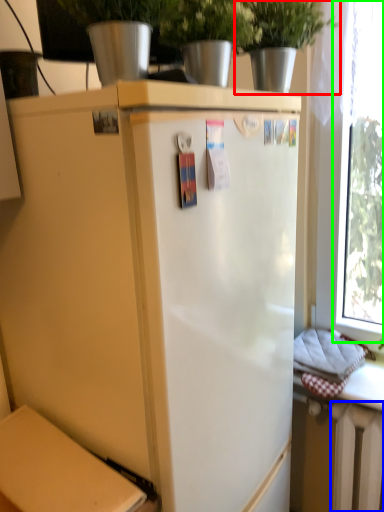
Question: Which object is the closest to the houseplant (highlighted by a red box)? Choose among these: radiator (highlighted by a blue box) or window (highlighted by a green box).

Choices:
 (A) radiator
 (B) window

Answer: (B)